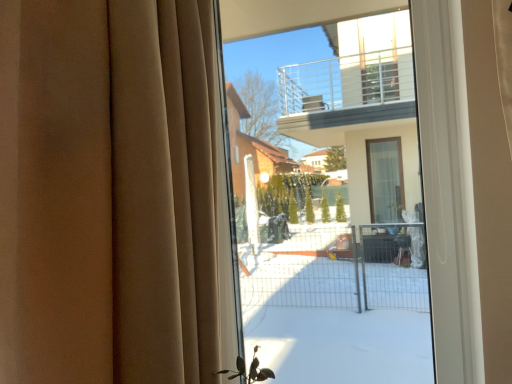
Question: Is beige fabric curtain at left outside transparent glass bay window at center?

Choices:
 (A) no
 (B) yes

Answer: (B)

Question: From a real-world perspective, is beige fabric curtain at left physically below transparent glass bay window at center?

Choices:
 (A) yes
 (B) no

Answer: (B)

Question: Does beige fabric curtain at left have a larger size compared to transparent glass bay window at center?

Choices:
 (A) no
 (B) yes

Answer: (B)

Question: Is beige fabric curtain at left facing away from transparent glass bay window at center?

Choices:
 (A) yes
 (B) no

Answer: (B)

Question: Does beige fabric curtain at left lie in front of transparent glass bay window at center?

Choices:
 (A) yes
 (B) no

Answer: (A)

Question: From the image's perspective, is beige fabric curtain at left beneath transparent glass bay window at center?

Choices:
 (A) no
 (B) yes

Answer: (B)

Question: Considering the relative positions of transparent glass bay window at center and beige fabric curtain at left in the image provided, is transparent glass bay window at center to the left of beige fabric curtain at left from the viewer's perspective?

Choices:
 (A) yes
 (B) no

Answer: (B)

Question: From a real-world perspective, is transparent glass bay window at center on top of beige fabric curtain at left?

Choices:
 (A) no
 (B) yes

Answer: (A)

Question: From the image's perspective, does transparent glass bay window at center appear lower than beige fabric curtain at left?

Choices:
 (A) no
 (B) yes

Answer: (A)

Question: Is transparent glass bay window at center in contact with beige fabric curtain at left?

Choices:
 (A) no
 (B) yes

Answer: (A)

Question: From the image's perspective, is transparent glass bay window at center on top of beige fabric curtain at left?

Choices:
 (A) yes
 (B) no

Answer: (A)

Question: Is transparent glass bay window at center to the right of beige fabric curtain at left from the viewer's perspective?

Choices:
 (A) no
 (B) yes

Answer: (B)

Question: From the image's perspective, is beige fabric curtain at left positioned above or below transparent glass bay window at center?

Choices:
 (A) above
 (B) below

Answer: (B)